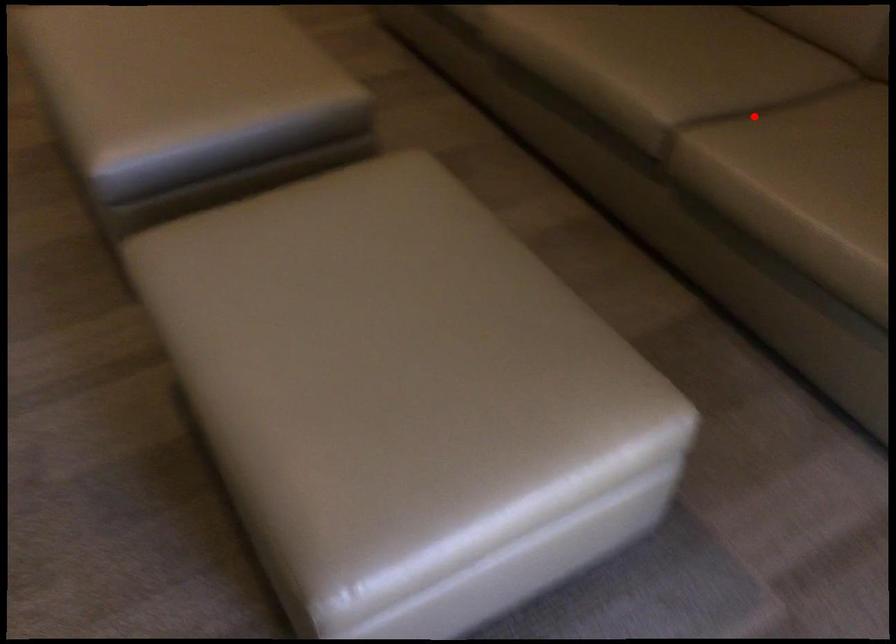
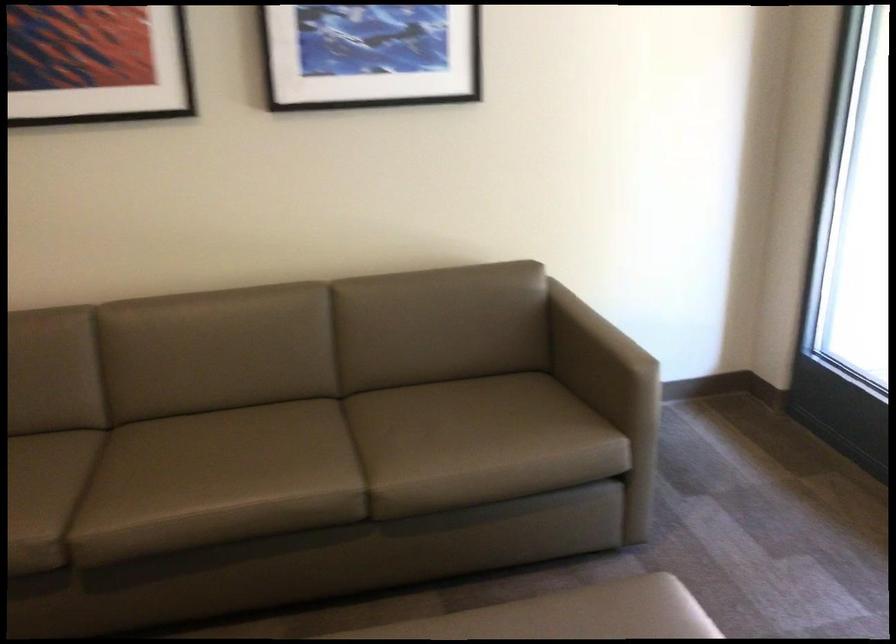
Question: I am providing you with two images of the same scene from different viewpoints. A red point is shown in image1. For the corresponding object point in image2, is it positioned nearer or farther from the camera?

Choices:
 (A) Nearer
 (B) Farther

Answer: (B)